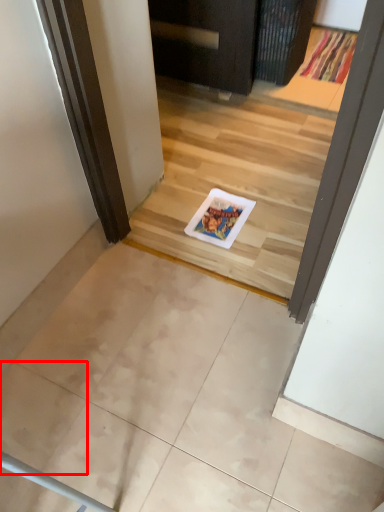
Question: From the image's perspective, considering the relative positions of ceramic tile (annotated by the red box) and doormat in the image provided, where is ceramic tile (annotated by the red box) located with respect to the staircase?

Choices:
 (A) above
 (B) below

Answer: (B)